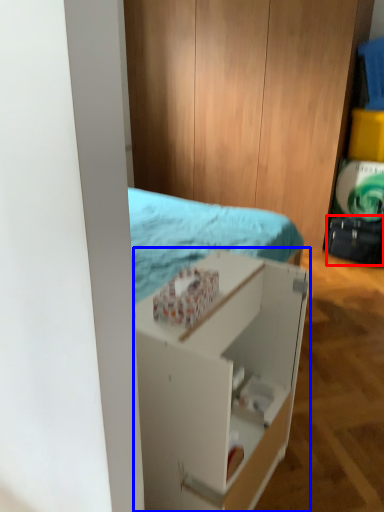
Question: Which of the following is the closest to the observer, luggage (highlighted by a red box) or shelf (highlighted by a blue box)?

Choices:
 (A) luggage
 (B) shelf

Answer: (B)